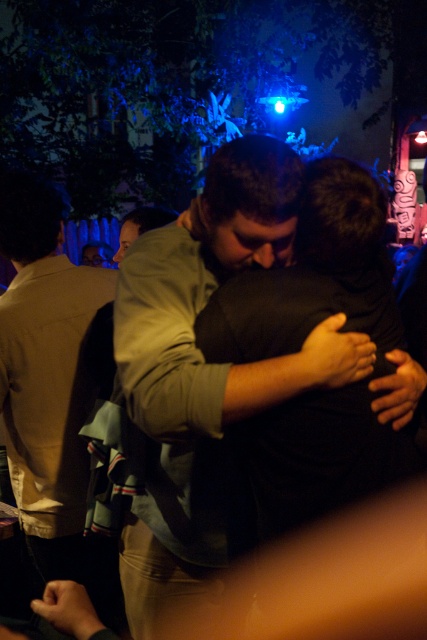
Question: Which object appears farthest from the camera in this image?

Choices:
 (A) matte green shirt at center
 (B) light brown leather jacket at left

Answer: (A)

Question: Is light brown leather jacket at left to the left of matte green shirt at center from the viewer's perspective?

Choices:
 (A) no
 (B) yes

Answer: (B)

Question: Is light brown leather jacket at left above matte green shirt at center?

Choices:
 (A) yes
 (B) no

Answer: (B)

Question: Is light brown leather jacket at left smaller than matte green shirt at center?

Choices:
 (A) no
 (B) yes

Answer: (A)

Question: Which object is farther from the camera taking this photo?

Choices:
 (A) light brown leather jacket at left
 (B) matte green shirt at center

Answer: (B)

Question: Among these objects, which one is nearest to the camera?

Choices:
 (A) matte green shirt at center
 (B) light brown leather jacket at left

Answer: (B)